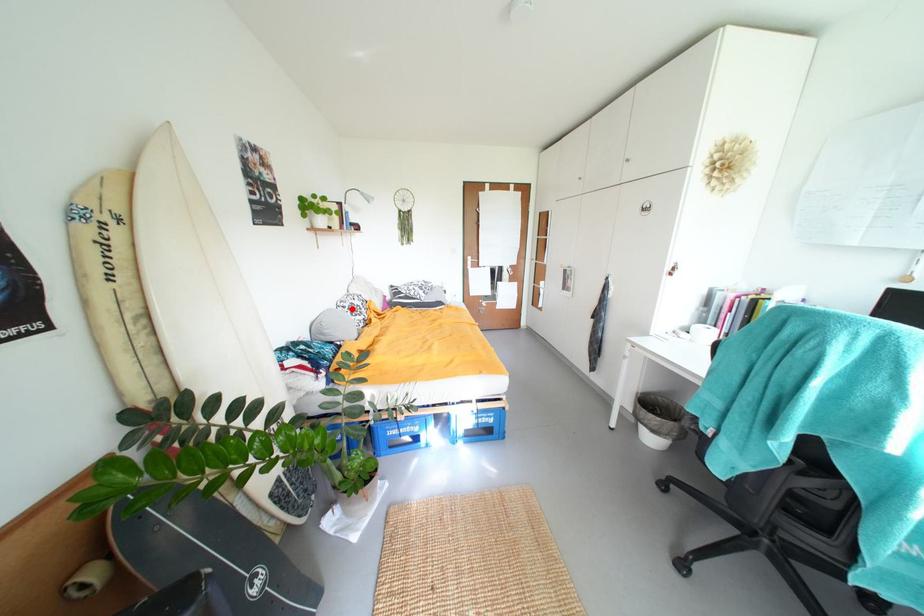
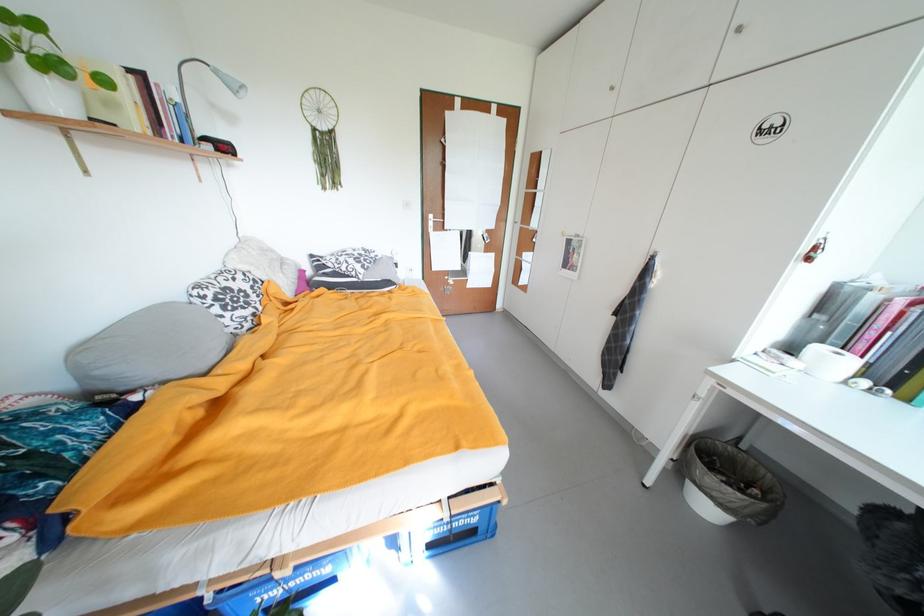
In the second image, find the point that corresponds to the highlighted location in the first image.

(211, 299)